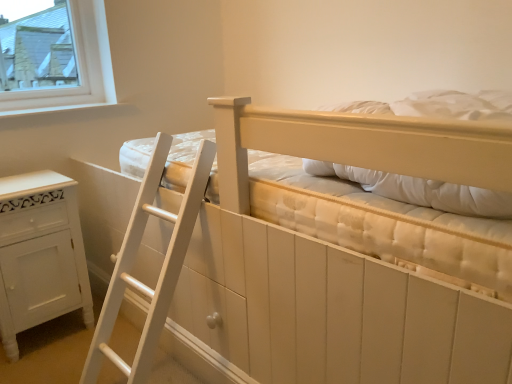
Question: Does white painted wood cabinet at lower left have a greater height compared to matte white bunk bed at center?

Choices:
 (A) no
 (B) yes

Answer: (A)

Question: Is white painted wood cabinet at lower left far away from matte white bunk bed at center?

Choices:
 (A) no
 (B) yes

Answer: (A)

Question: Would you say matte white bunk bed at center is part of white painted wood cabinet at lower left's contents?

Choices:
 (A) yes
 (B) no

Answer: (B)

Question: Does white painted wood cabinet at lower left appear on the left side of matte white bunk bed at center?

Choices:
 (A) no
 (B) yes

Answer: (B)

Question: Is white painted wood cabinet at lower left placed right next to matte white bunk bed at center?

Choices:
 (A) no
 (B) yes

Answer: (A)

Question: Would you say white painted wood cabinet at lower left is outside matte white bunk bed at center?

Choices:
 (A) yes
 (B) no

Answer: (A)

Question: From the image's perspective, is matte white bunk bed at center located above white wood at upper left?

Choices:
 (A) no
 (B) yes

Answer: (A)

Question: Is matte white bunk bed at center positioned in front of white wood at upper left?

Choices:
 (A) no
 (B) yes

Answer: (B)

Question: Does matte white bunk bed at center have a lesser height compared to white wood at upper left?

Choices:
 (A) no
 (B) yes

Answer: (A)

Question: Is matte white bunk bed at center oriented towards white wood at upper left?

Choices:
 (A) no
 (B) yes

Answer: (B)

Question: From a real-world perspective, is matte white bunk bed at center positioned over white wood at upper left based on gravity?

Choices:
 (A) no
 (B) yes

Answer: (A)

Question: Does matte white bunk bed at center come behind white wood at upper left?

Choices:
 (A) no
 (B) yes

Answer: (A)

Question: Does white wood at upper left have a greater height compared to white painted wood cabinet at lower left?

Choices:
 (A) no
 (B) yes

Answer: (A)